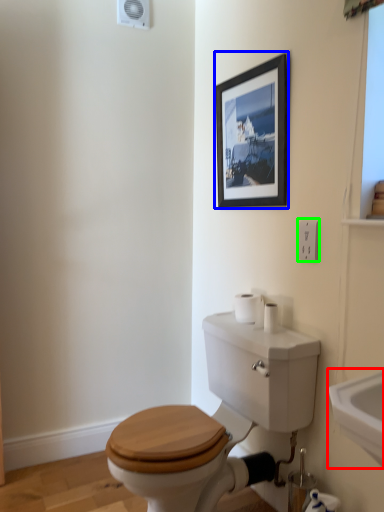
Question: Considering the real-world distances, which object is closest to sink (highlighted by a red box)? picture frame (highlighted by a blue box) or electric outlet (highlighted by a green box).

Choices:
 (A) picture frame
 (B) electric outlet

Answer: (B)